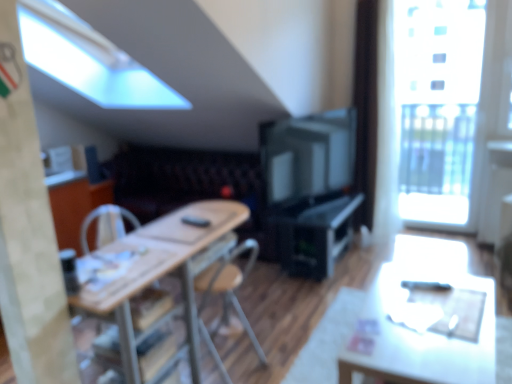
Identify the location of blank space above matte white table at lower right (from a real-world perspective). The height and width of the screenshot is (384, 512). (422, 319).